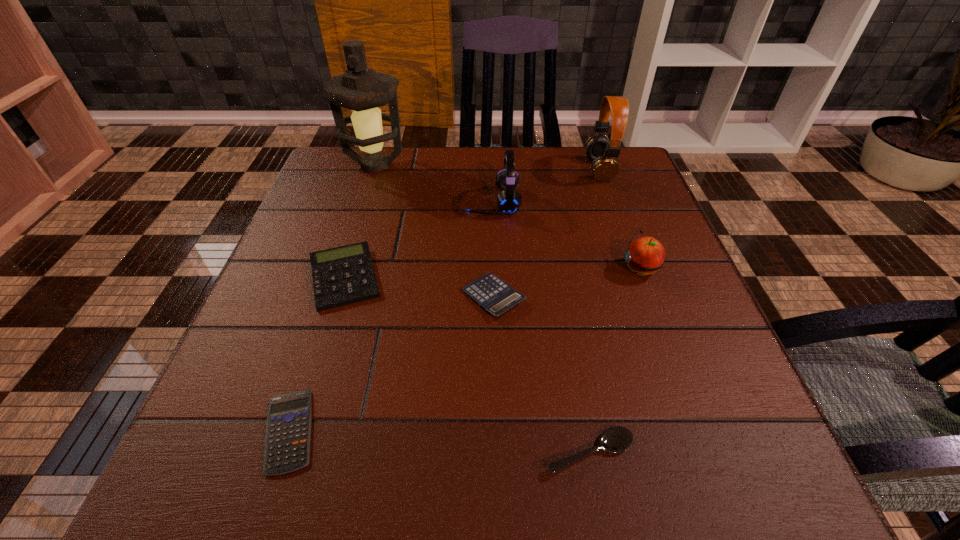
The width and height of the screenshot is (960, 540). In order to click on vacant area situated 0.100m on the back of the shortest calculator in this screenshot , I will do `click(319, 340)`.

Find the location of a particular element. The height and width of the screenshot is (540, 960). oil lamp located at the far edge is located at coordinates (361, 89).

This screenshot has width=960, height=540. I want to click on soupspoon positioned at the near edge, so click(615, 439).

You are a GUI agent. You are given a task and a screenshot of the screen. Output one action in this format:
    pyautogui.click(x=<x>, y=<y>)
    Task: Click on the calculator positioned at the near edge
    The image size is (960, 540).
    Given the screenshot: What is the action you would take?
    pyautogui.click(x=288, y=429)

Identify the location of oil lamp that is at the left edge. (361, 89).

Identify the location of headset positioned at the right edge. (603, 153).

Where is `apple that is positioned at the right edge`? Image resolution: width=960 pixels, height=540 pixels. apple that is positioned at the right edge is located at coordinates (645, 255).

You are a GUI agent. You are given a task and a screenshot of the screen. Output one action in this format:
    pyautogui.click(x=<x>, y=<y>)
    Task: Click on the object that is at the far left corner
    This screenshot has width=960, height=540.
    Given the screenshot: What is the action you would take?
    pyautogui.click(x=361, y=89)

You are a GUI agent. You are given a task and a screenshot of the screen. Output one action in this format:
    pyautogui.click(x=<x>, y=<y>)
    Task: Click on the object that is at the near left corner
    The height and width of the screenshot is (540, 960).
    Given the screenshot: What is the action you would take?
    pyautogui.click(x=288, y=429)

You are a GUI agent. You are given a task and a screenshot of the screen. Output one action in this format:
    pyautogui.click(x=<x>, y=<y>)
    Task: Click on the object that is at the far right corner
    
    Given the screenshot: What is the action you would take?
    pyautogui.click(x=603, y=153)